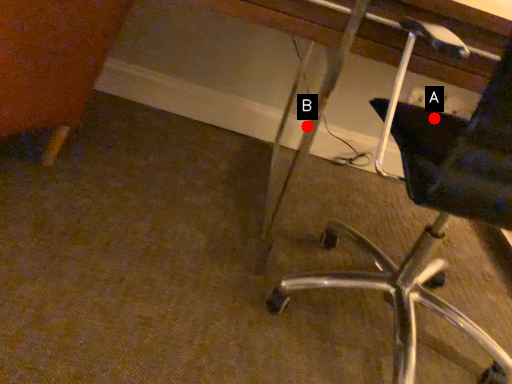
Question: Two points are circled on the image, labeled by A and B beside each circle. Which point is further to the camera?

Choices:
 (A) A is further
 (B) B is further

Answer: (B)